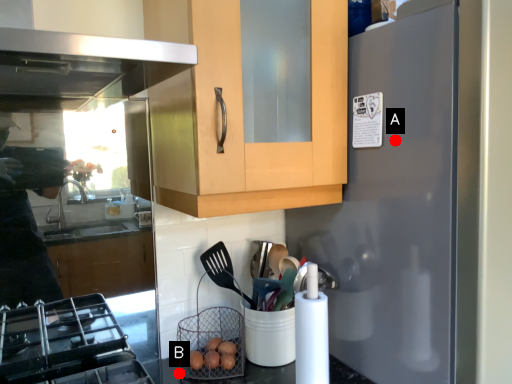
Question: Two points are circled on the image, labeled by A and B beside each circle. Which of the following is the farthest from the observer?

Choices:
 (A) A is further
 (B) B is further

Answer: (B)